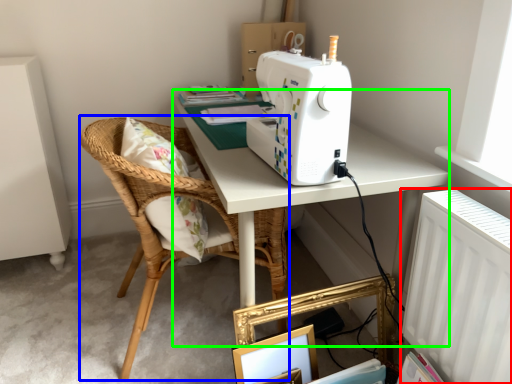
Question: Which is nearer to the radiator (highlighted by a red box)? chair (highlighted by a blue box) or table (highlighted by a green box).

Choices:
 (A) chair
 (B) table

Answer: (B)